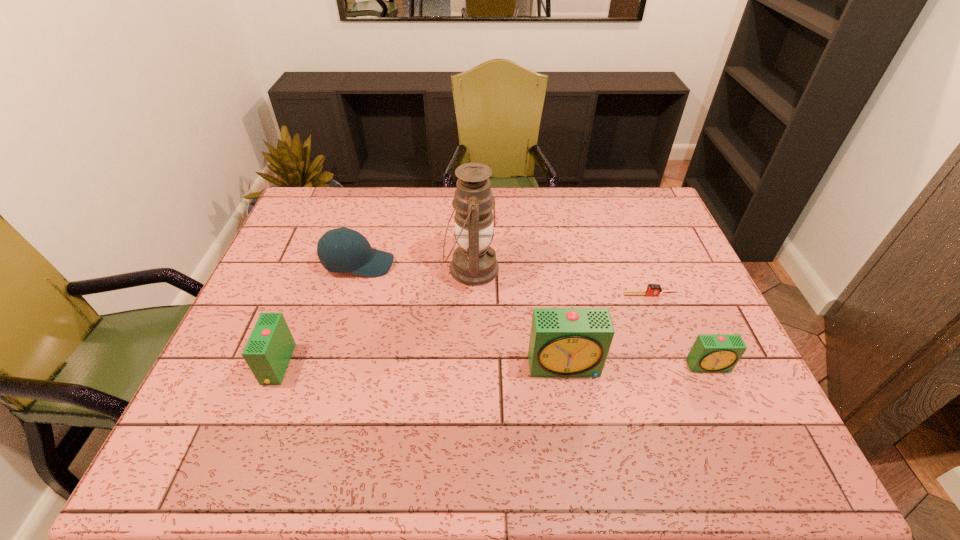
The height and width of the screenshot is (540, 960). Identify the location of location for an additional alarm_clock to make spacing equal. (421, 365).